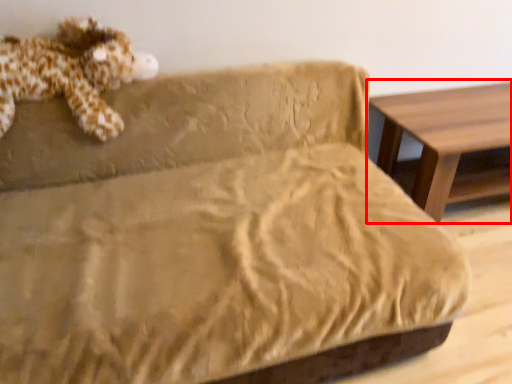
Question: From the image's perspective, where is table (annotated by the red box) located in relation to toy in the image?

Choices:
 (A) below
 (B) above

Answer: (A)